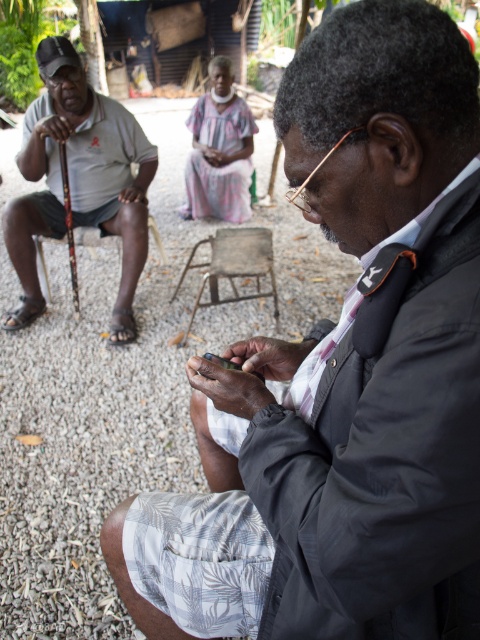
Who is lower down, matte gray shirt at left or wooden cane at left?

wooden cane at left

Between matte gray shirt at left and wooden cane at left, which one has more height?

matte gray shirt at left

Is point (130, 115) more distant than point (38, 243)?

Yes.

Where is `matte gray shirt at left`? This screenshot has height=640, width=480. matte gray shirt at left is located at coordinates (79, 180).

Can you confirm if metallic stool at center is wider than wooden cane at left?

Incorrect, metallic stool at center's width does not surpass wooden cane at left's.

Does metallic stool at center appear under wooden cane at left?

Yes.

Who is more distant from viewer, (217, 259) or (134, 166)?

The point (134, 166) is behind.

At what (x,y) coordinates should I click in order to perform the action: click on metallic stool at center. Please return your answer as a coordinate pair (x, y). The image size is (480, 640). Looking at the image, I should click on 232,266.

Can you confirm if matte gray shirt at left is taller than metallic stool at center?

Yes.

Is matte gray shirt at left to the right of metallic stool at center from the viewer's perspective?

Incorrect, matte gray shirt at left is not on the right side of metallic stool at center.

Where is `matte gray shirt at left`? matte gray shirt at left is located at coordinates (79, 180).